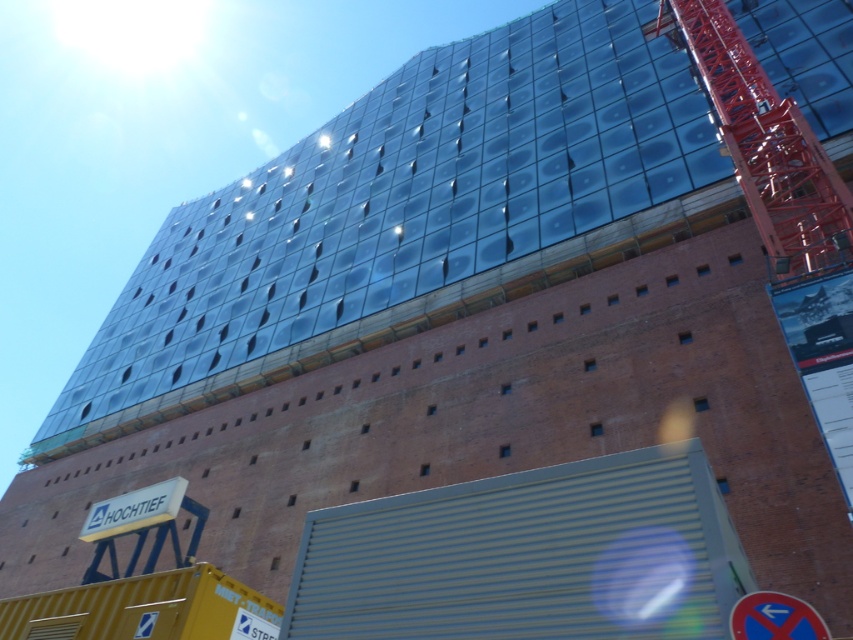
You are a construction worker standing near the yellow construction container with the logo Hochtief. You need to move the blue plastic sign at lower right to a new location. Which direction should you move it so that the metallic red crane at right is no longer directly to its right?

You should move the blue plastic sign at lower right to the left so that the metallic red crane at right is no longer directly to its right.

You are an inspector checking the construction site. You need to determine if the metallic red crane at right can fit through a narrow passage that is only as wide as the blue plastic sign at lower right. Can it pass through?

The metallic red crane at right is wider than the blue plastic sign at lower right, so it cannot pass through the passage that is as wide as the sign.